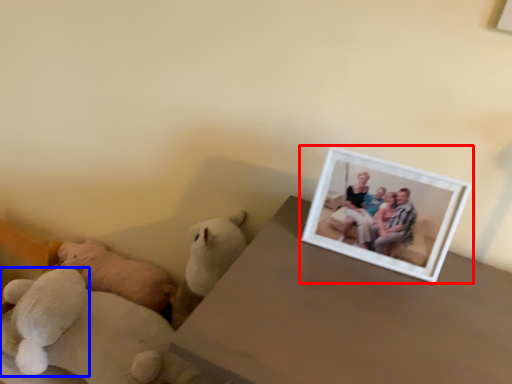
Question: Which object is closer to the camera taking this photo, picture frame (highlighted by a red box) or teddy bear (highlighted by a blue box)?

Choices:
 (A) picture frame
 (B) teddy bear

Answer: (A)